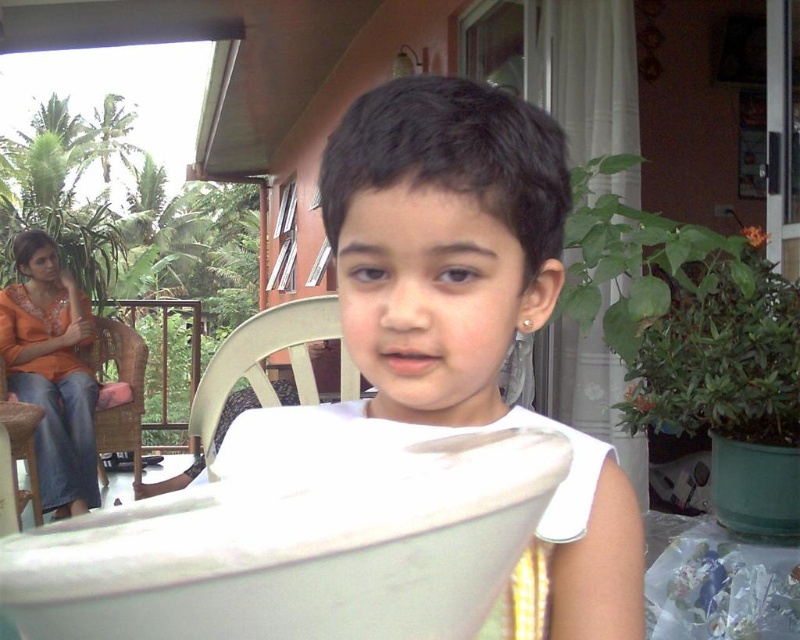
Does transparent plastic bag at lower right have a greater width compared to wooden chair at center?

No.

Between transparent plastic bag at lower right and wooden chair at center, which one is positioned higher?

wooden chair at center

Find the location of a particular element. This screenshot has height=640, width=800. transparent plastic bag at lower right is located at coordinates (718, 586).

Does white matte paper at center have a greater height compared to transparent plastic bag at lower right?

Yes, white matte paper at center is taller than transparent plastic bag at lower right.

The width and height of the screenshot is (800, 640). I want to click on white matte paper at center, so click(474, 316).

This screenshot has width=800, height=640. What are the coordinates of `white matte paper at center` in the screenshot? It's located at (474, 316).

Describe the element at coordinates (718, 586) in the screenshot. The height and width of the screenshot is (640, 800). I see `transparent plastic bag at lower right` at that location.

Identify the location of transparent plastic bag at lower right. Image resolution: width=800 pixels, height=640 pixels. (718, 586).

Identify the location of transparent plastic bag at lower right. (718, 586).